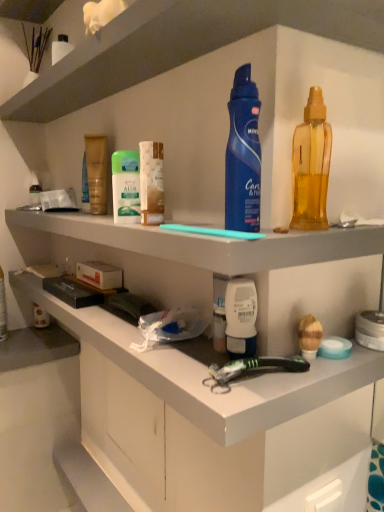
Question: Would you say metallic silver tube at left, placed as the first toiletry when sorted from left to right, is a long distance from blue matte deodorant at center, which ranks as the first cleaning product in left-to-right order?

Choices:
 (A) yes
 (B) no

Answer: (B)

Question: Can we say metallic silver tube at left, which is the 4th toiletry from front to back, lies outside blue matte deodorant at center, acting as the 2th cleaning product starting from the right?

Choices:
 (A) yes
 (B) no

Answer: (A)

Question: Is metallic silver tube at left, which is the 4th toiletry from front to back, further to the viewer compared to blue matte deodorant at center, which ranks as the first cleaning product in left-to-right order?

Choices:
 (A) no
 (B) yes

Answer: (B)

Question: Does metallic silver tube at left, which ranks as the first toiletry in back-to-front order, have a larger size compared to blue matte deodorant at center, which ranks as the first cleaning product in left-to-right order?

Choices:
 (A) no
 (B) yes

Answer: (A)

Question: Does metallic silver tube at left, which ranks as the first toiletry in back-to-front order, have a greater width compared to blue matte deodorant at center, acting as the 2th cleaning product starting from the right?

Choices:
 (A) yes
 (B) no

Answer: (B)

Question: Does metallic silver tube at left, placed as the first toiletry when sorted from left to right, have a smaller size compared to blue matte deodorant at center, acting as the 2th cleaning product starting from the right?

Choices:
 (A) yes
 (B) no

Answer: (A)

Question: Considering the relative positions of translucent golden lotion at center, the third toiletry positioned from the right, and white matte cabinet at lower center, marked as the 1th shelf in a bottom-to-top arrangement, in the image provided, is translucent golden lotion at center, the third toiletry positioned from the right, to the right of white matte cabinet at lower center, marked as the 1th shelf in a bottom-to-top arrangement, from the viewer's perspective?

Choices:
 (A) yes
 (B) no

Answer: (B)

Question: Is translucent golden lotion at center, the third toiletry positioned from the right, positioned with its back to white matte cabinet at lower center, marked as the 1th shelf in a bottom-to-top arrangement?

Choices:
 (A) yes
 (B) no

Answer: (B)

Question: Can white matte cabinet at lower center, marked as the 1th shelf in a bottom-to-top arrangement, be found inside translucent golden lotion at center, positioned as the 3th toiletry in front-to-back order?

Choices:
 (A) yes
 (B) no

Answer: (B)

Question: Does translucent golden lotion at center, positioned as the 3th toiletry in front-to-back order, have a greater width compared to white matte cabinet at lower center, which is the 3th shelf in top-to-bottom order?

Choices:
 (A) yes
 (B) no

Answer: (B)

Question: From the image's perspective, is translucent golden lotion at center, arranged as the second toiletry when viewed from the left, above white matte cabinet at lower center, marked as the 1th shelf in a bottom-to-top arrangement?

Choices:
 (A) no
 (B) yes

Answer: (B)

Question: Is translucent golden lotion at center, arranged as the 2th toiletry when viewed from the back, outside of white matte cabinet at lower center, marked as the 1th shelf in a bottom-to-top arrangement?

Choices:
 (A) yes
 (B) no

Answer: (A)

Question: From a real-world perspective, does white matte cabinet at lower center, which is the 3th shelf in top-to-bottom order, sit lower than translucent yellow liquid at right, acting as the second cleaning product starting from the left?

Choices:
 (A) yes
 (B) no

Answer: (A)